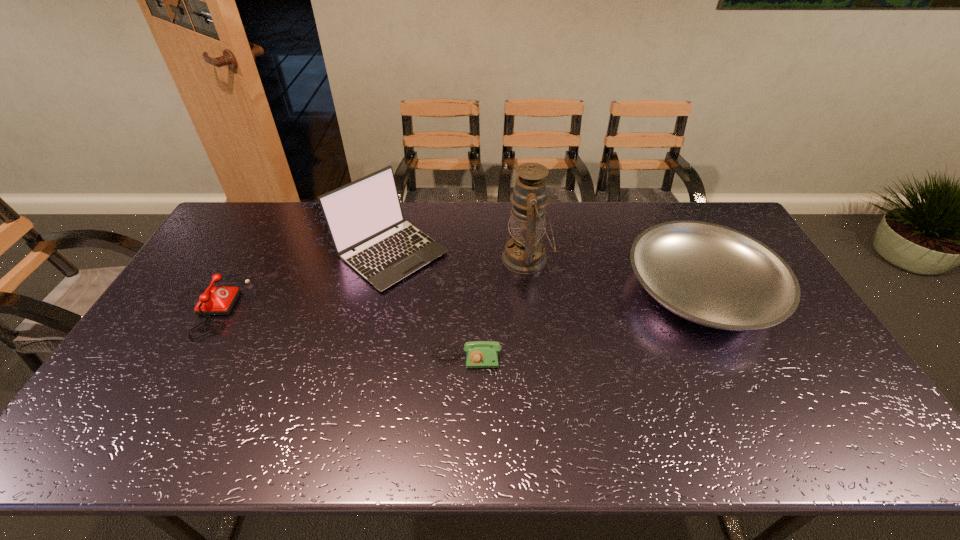
Where is `the tallest object`? The image size is (960, 540). the tallest object is located at coordinates (525, 253).

I want to click on oil lamp, so click(525, 253).

Identify the location of the fourth shortest object. (362, 215).

Find the location of a particular element. bedpan is located at coordinates (712, 275).

I want to click on the rightmost object, so click(712, 275).

You are a GUI agent. You are given a task and a screenshot of the screen. Output one action in this format:
    pyautogui.click(x=<x>, y=<y>)
    Task: Click on the second shortest object
    
    Given the screenshot: What is the action you would take?
    pyautogui.click(x=215, y=300)

At what (x,y) coordinates should I click in order to perform the action: click on the taller telephone. Please return your answer as a coordinate pair (x, y). The image size is (960, 540). Looking at the image, I should click on (215, 300).

The image size is (960, 540). In order to click on the shortest object in this screenshot , I will do (479, 354).

I want to click on the right telephone, so click(479, 354).

You are a GUI agent. You are given a task and a screenshot of the screen. Output one action in this format:
    pyautogui.click(x=<x>, y=<y>)
    Task: Click on the vacant region located 0.280m on the front of the fourth object from left to right
    This screenshot has width=960, height=540.
    Given the screenshot: What is the action you would take?
    pyautogui.click(x=538, y=356)